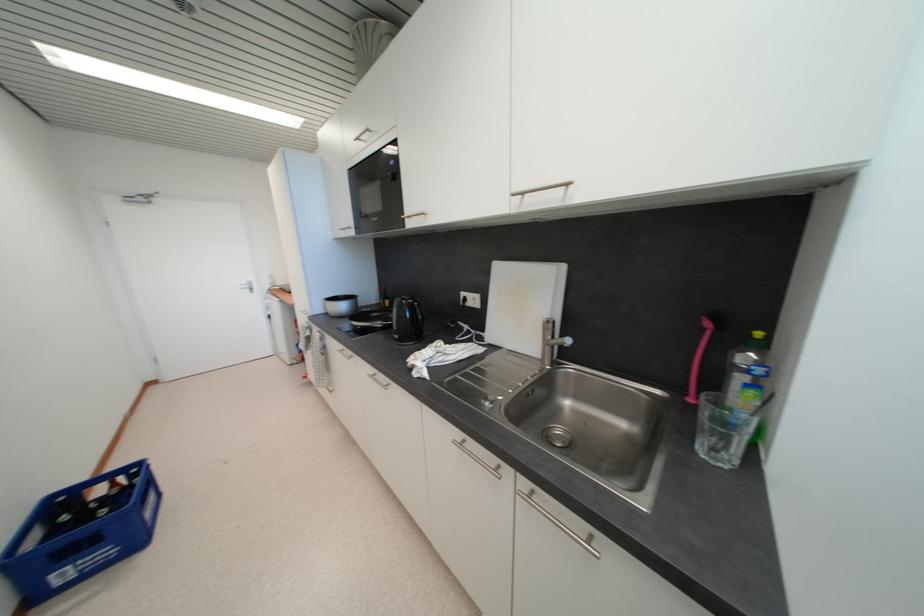
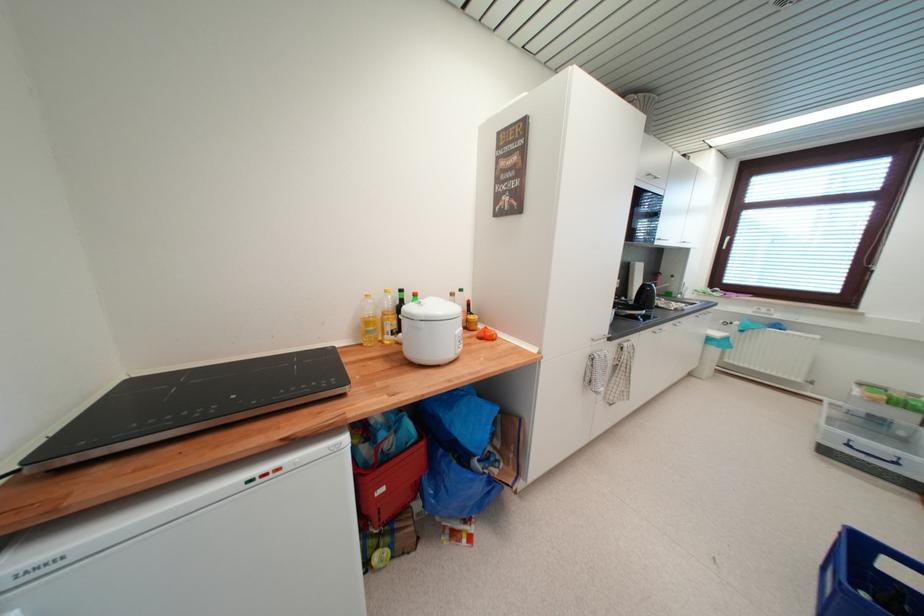
Question: I am providing you with two images of the same scene from different viewpoints. Please identify which objects are invisible in image2.

Choices:
 (A) dark green bottle
 (B) black kettle handle
 (C) dark glass bottle
 (D) turquoise suitcase

Answer: (C)